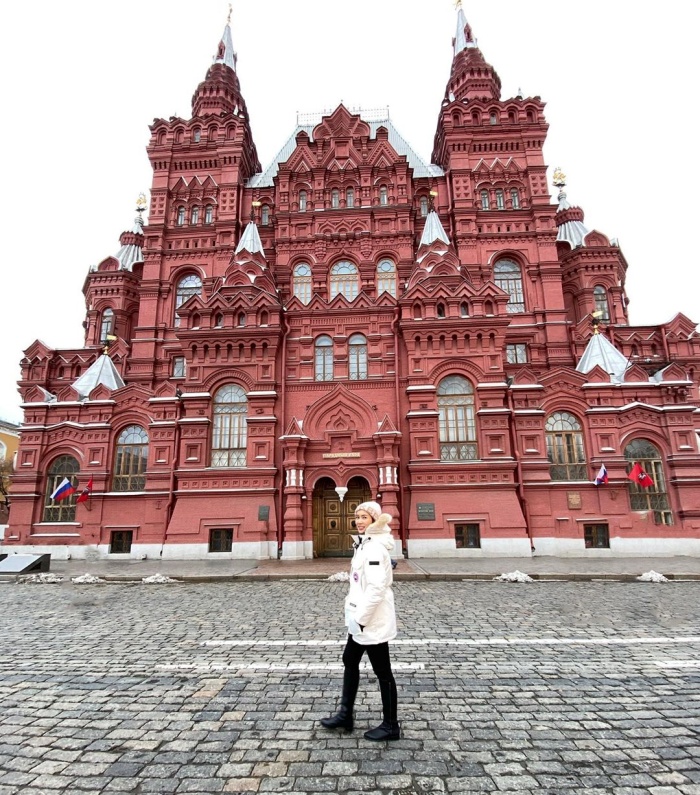
Find the location of a particular element. The image size is (700, 795). door is located at coordinates (x=334, y=522).